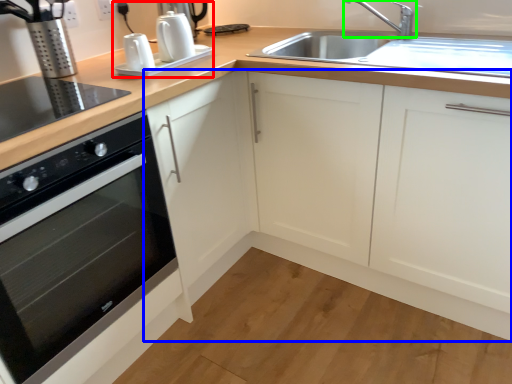
Question: Which object is the farthest from coffee machine (highlighted by a red box)? Choose among these: cabinetry (highlighted by a blue box) or tap (highlighted by a green box).

Choices:
 (A) cabinetry
 (B) tap

Answer: (B)